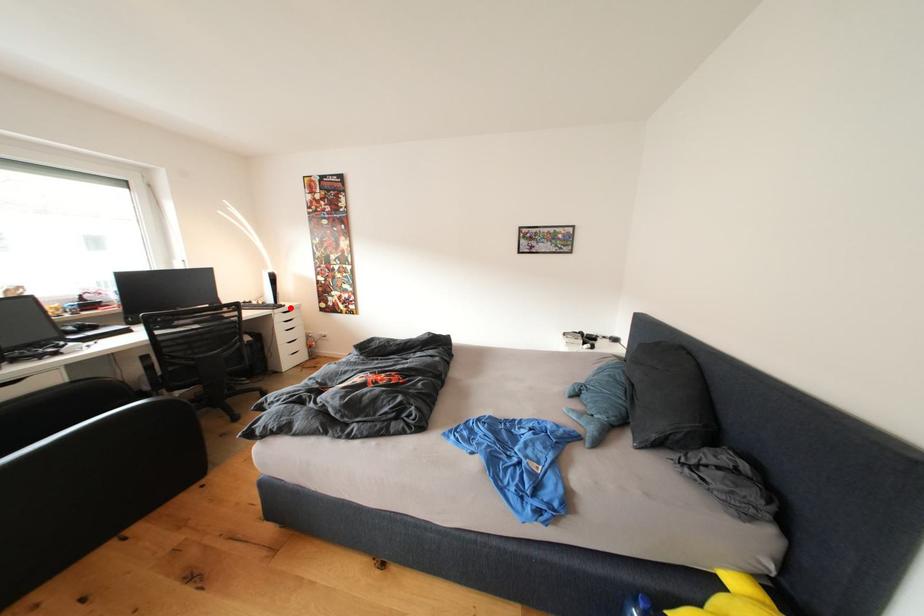
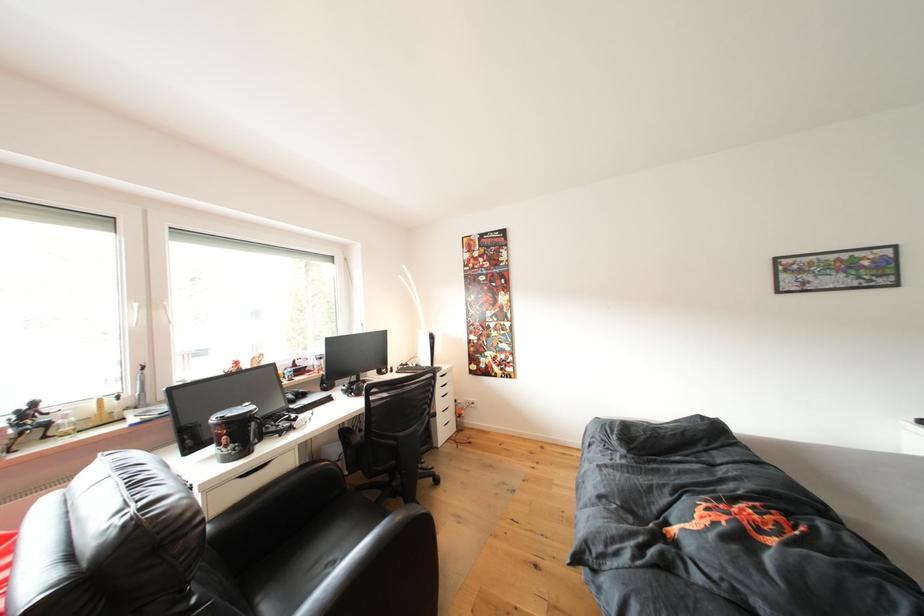
Question: I am providing you with two images of the same scene from different viewpoints. A red point is shown in image1. For the corresponding object point in image2, is it positioned nearer or farther from the camera?

Choices:
 (A) Nearer
 (B) Farther

Answer: (B)